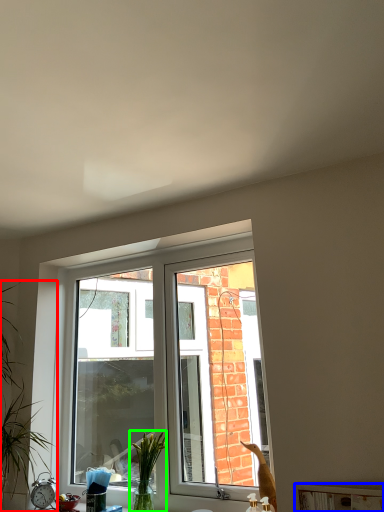
Question: Considering the real-world distances, which object is farthest from houseplant (highlighted by a red box)? window sill (highlighted by a blue box) or plant (highlighted by a green box)?

Choices:
 (A) window sill
 (B) plant

Answer: (A)